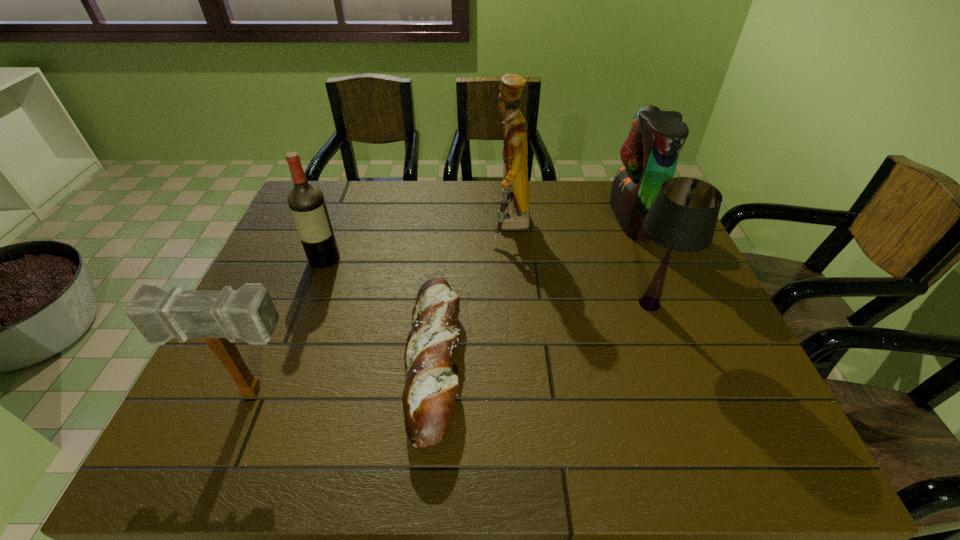
I want to click on vacant space at the left edge of the desktop, so click(x=201, y=401).

Where is `vacant region at the right edge of the desktop`? Image resolution: width=960 pixels, height=540 pixels. vacant region at the right edge of the desktop is located at coordinates (662, 311).

Find the location of a particular element. free location at the near left corner of the desktop is located at coordinates (179, 457).

The image size is (960, 540). What are the coordinates of `free point between the liquor and the parrot` in the screenshot? It's located at (478, 238).

Identify the location of empty location between the third object from left to right and the lampshade. This screenshot has width=960, height=540. (541, 333).

You are a GUI agent. You are given a task and a screenshot of the screen. Output one action in this format:
    pyautogui.click(x=<x>, y=<y>)
    Task: Click on the free space between the parrot and the third object from right to left
    The image size is (960, 540).
    Given the screenshot: What is the action you would take?
    pyautogui.click(x=571, y=222)

The width and height of the screenshot is (960, 540). In order to click on vacant space in between the baguet and the parrot in this screenshot , I will do `click(533, 289)`.

Find the location of a particular element. The height and width of the screenshot is (540, 960). free point between the mallet and the shortest object is located at coordinates (345, 376).

The width and height of the screenshot is (960, 540). What are the coordinates of `unoccupied position between the mallet and the fourth nearest object` in the screenshot? It's located at (290, 325).

Where is `free space between the mallet and the shortest object`? The height and width of the screenshot is (540, 960). free space between the mallet and the shortest object is located at coordinates (345, 376).